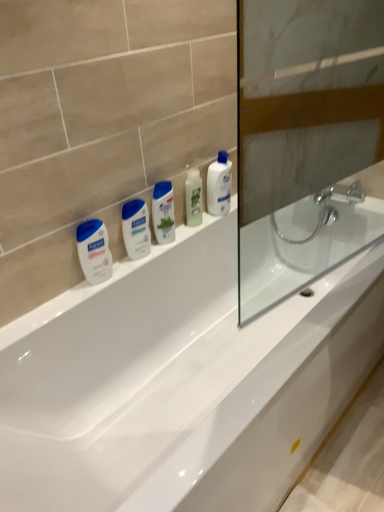
Question: Which direction should I rotate to look at white glossy mouthwash at center, which is the first mouthwash in right-to-left order, — up or down?

Choices:
 (A) down
 (B) up

Answer: (B)

Question: Is white glossy mouthwash at center, positioned as the second mouthwash in left-to-right order, smaller than transparent glass screen door at right?

Choices:
 (A) no
 (B) yes

Answer: (B)

Question: Is white glossy mouthwash at center, positioned as the second mouthwash in left-to-right order, aimed at transparent glass screen door at right?

Choices:
 (A) no
 (B) yes

Answer: (B)

Question: Considering the relative sizes of white glossy mouthwash at center, positioned as the second mouthwash in left-to-right order, and transparent glass screen door at right in the image provided, is white glossy mouthwash at center, positioned as the second mouthwash in left-to-right order, bigger than transparent glass screen door at right?

Choices:
 (A) no
 (B) yes

Answer: (A)

Question: Is white glossy mouthwash at center, placed as the third mouthwash when sorted from right to left, at the left side of transparent glass screen door at right?

Choices:
 (A) yes
 (B) no

Answer: (A)

Question: Can you confirm if white glossy mouthwash at center, placed as the third mouthwash when sorted from right to left, is positioned to the right of transparent glass screen door at right?

Choices:
 (A) no
 (B) yes

Answer: (A)

Question: Are white glossy mouthwash at center, positioned as the second mouthwash in left-to-right order, and transparent glass screen door at right located far from each other?

Choices:
 (A) yes
 (B) no

Answer: (B)

Question: Is white glossy lotion at left, which is the fourth mouthwash in right-to-left order, thinner than green matte mouthwash at center, marked as the 2th mouthwash in a right-to-left arrangement?

Choices:
 (A) no
 (B) yes

Answer: (B)

Question: From a real-world perspective, is white glossy lotion at left, which is the fourth mouthwash in right-to-left order, located beneath green matte mouthwash at center, which ranks as the third mouthwash in left-to-right order?

Choices:
 (A) yes
 (B) no

Answer: (A)

Question: Would you say white glossy lotion at left, the first mouthwash in the left-to-right sequence, contains green matte mouthwash at center, which ranks as the third mouthwash in left-to-right order?

Choices:
 (A) no
 (B) yes

Answer: (A)

Question: Can you confirm if white glossy lotion at left, the first mouthwash in the left-to-right sequence, is shorter than green matte mouthwash at center, marked as the 2th mouthwash in a right-to-left arrangement?

Choices:
 (A) no
 (B) yes

Answer: (B)

Question: Is white glossy lotion at left, which is the fourth mouthwash in right-to-left order, positioned beyond the bounds of green matte mouthwash at center, marked as the 2th mouthwash in a right-to-left arrangement?

Choices:
 (A) yes
 (B) no

Answer: (A)

Question: Can you confirm if white glossy lotion at left, the first mouthwash in the left-to-right sequence, is wider than green matte mouthwash at center, which ranks as the third mouthwash in left-to-right order?

Choices:
 (A) no
 (B) yes

Answer: (A)

Question: Is green matte mouthwash at center, marked as the 2th mouthwash in a right-to-left arrangement, facing away from white glossy mouthwash at center, which is counted as the fourth mouthwash, starting from the left?

Choices:
 (A) no
 (B) yes

Answer: (A)